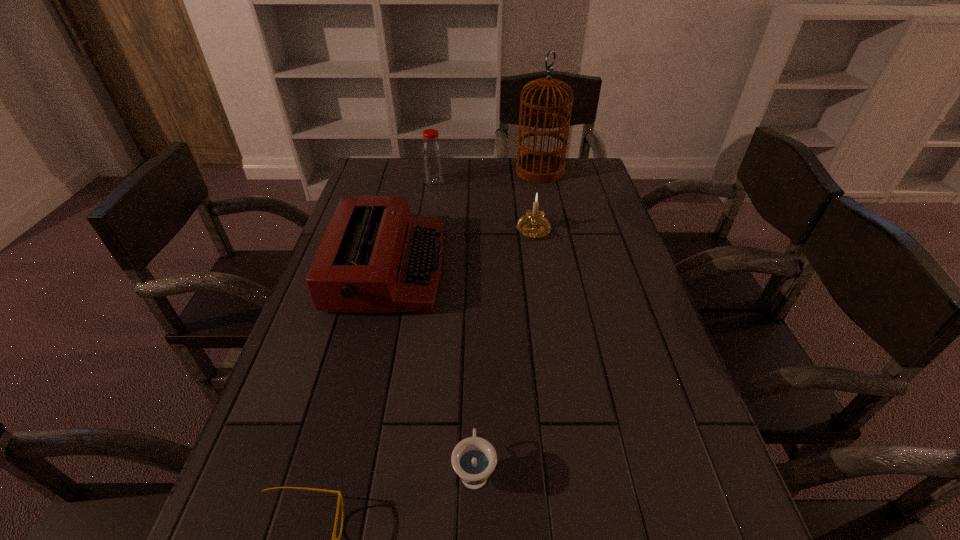
The height and width of the screenshot is (540, 960). Identify the location of blank space located 0.080m on the side of the fifth tallest object with the handle. (475, 406).

Identify the location of free space located on the side of the fifth tallest object with the handle. This screenshot has width=960, height=540. [476, 306].

The width and height of the screenshot is (960, 540). I want to click on vacant space located on the side of the fifth tallest object with the handle, so click(475, 376).

This screenshot has height=540, width=960. Find the location of `birdcage present at the far edge`. birdcage present at the far edge is located at coordinates (534, 166).

At what (x,y) coordinates should I click in order to perform the action: click on bottle that is at the far edge. Please return your answer as a coordinate pair (x, y). This screenshot has width=960, height=540. Looking at the image, I should click on (432, 159).

The image size is (960, 540). I want to click on object at the left edge, so click(x=376, y=256).

Image resolution: width=960 pixels, height=540 pixels. Find the location of `object situated at the right edge`. object situated at the right edge is located at coordinates (534, 166).

Find the location of a particular element. object located in the far right corner section of the desktop is located at coordinates (534, 166).

Where is `vacant region at the far edge`? Image resolution: width=960 pixels, height=540 pixels. vacant region at the far edge is located at coordinates (454, 164).

The height and width of the screenshot is (540, 960). What are the coordinates of `vacant space at the left edge of the desktop` in the screenshot? It's located at (328, 327).